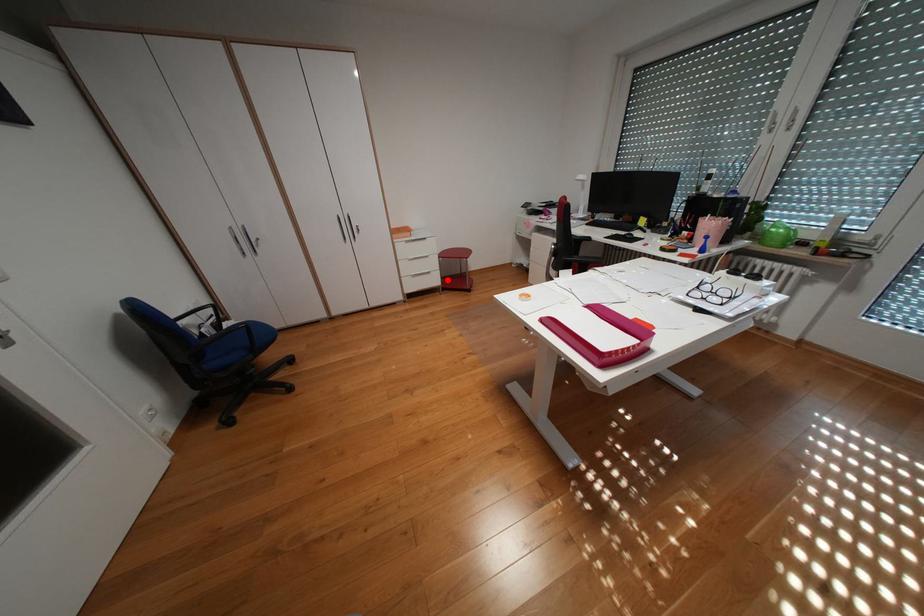
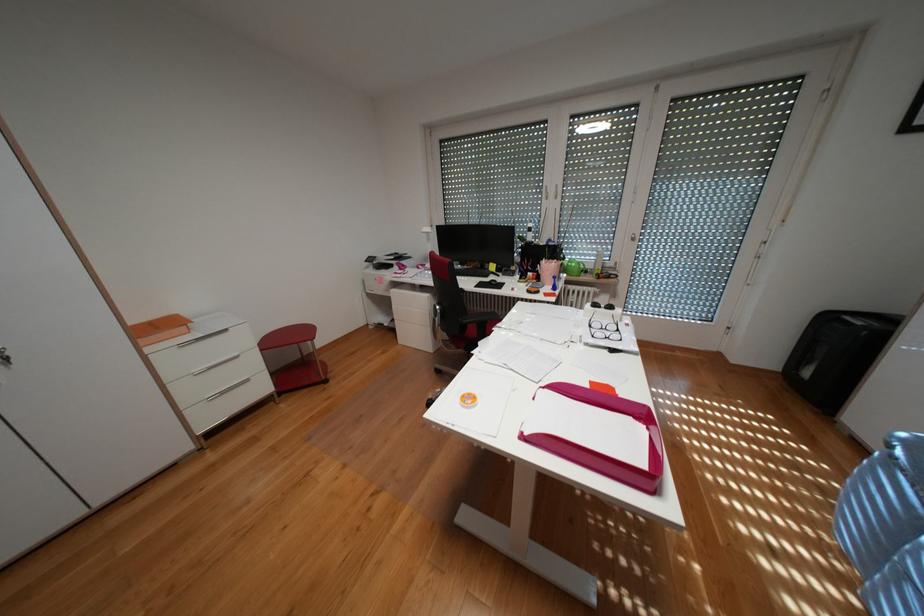
Question: I am providing you with two images of the same scene from different viewpoints. In image1, a red point is highlighted. Considering the same 3D point in image2, which of the following is correct?

Choices:
 (A) It is closer
 (B) It is farther

Answer: (B)